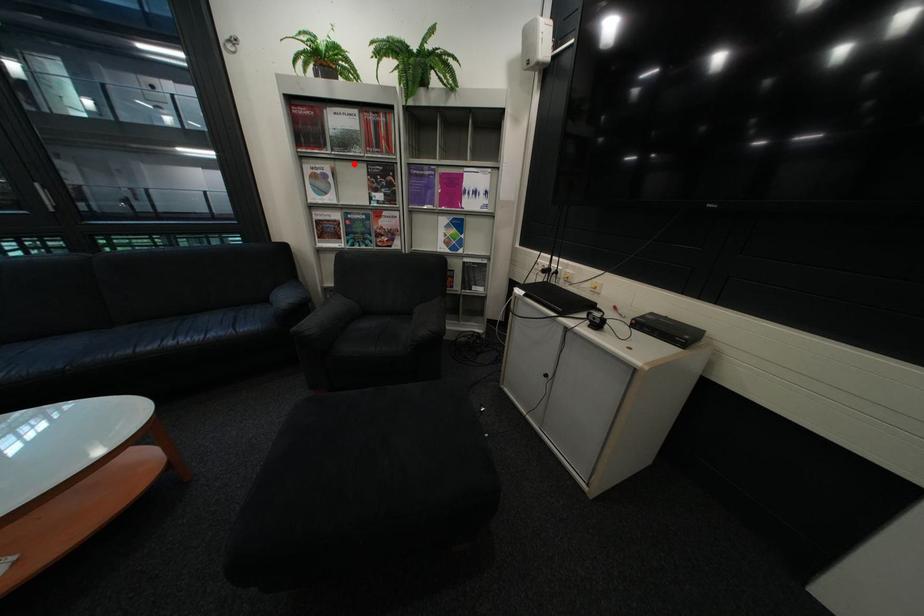
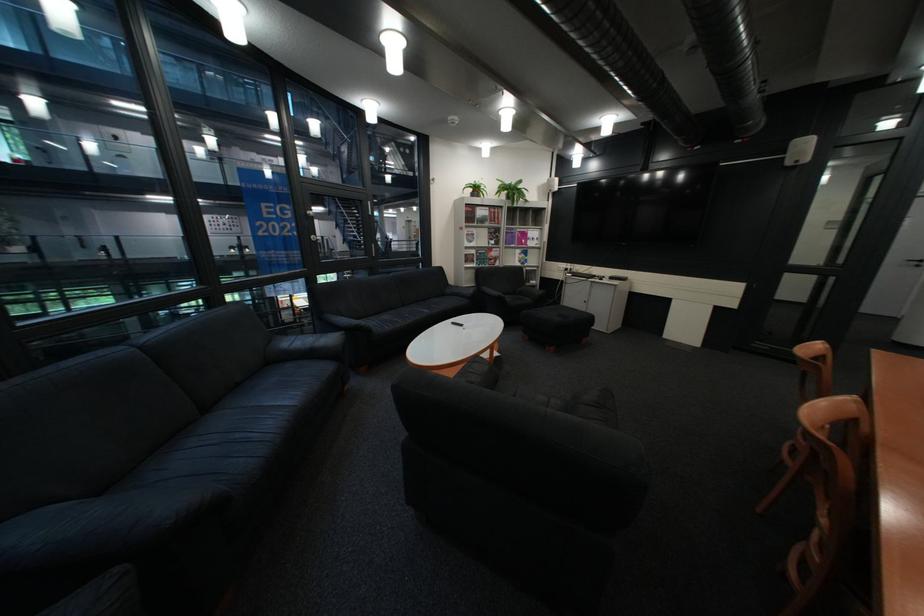
The point at the highlighted location is marked in the first image. Where is the corresponding point in the second image?

(492, 229)